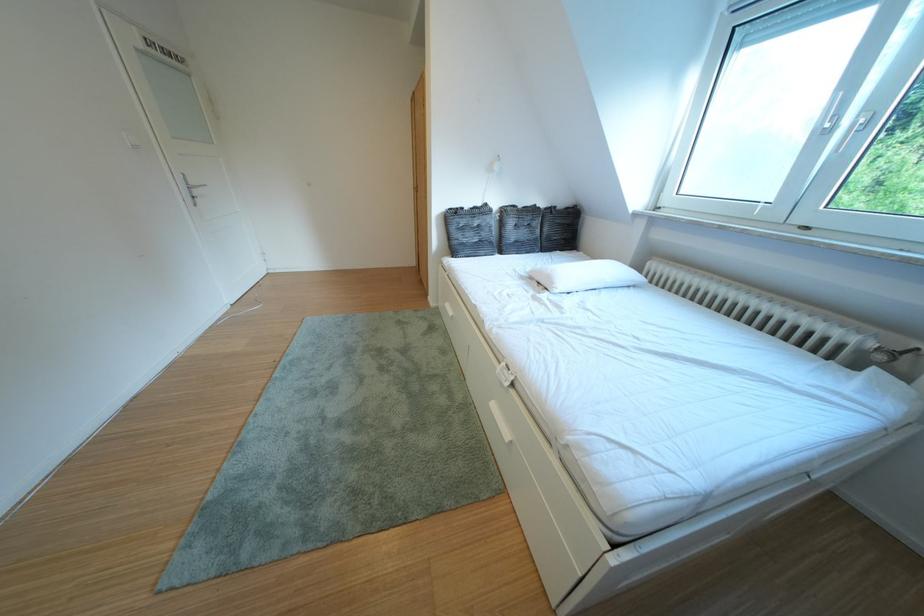
Find the location of `white light switch`. white light switch is located at coordinates (130, 140).